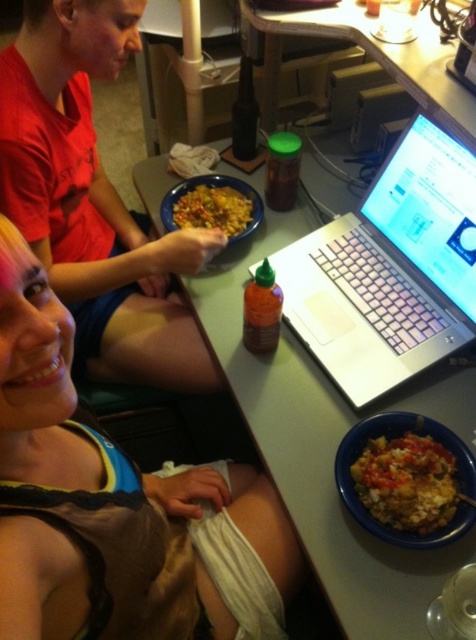
Does matte red shirt at upper left have a lesser width compared to green matte table at center?

Yes.

Between matte red shirt at upper left and green matte table at center, which one is positioned lower?

green matte table at center is lower down.

Image resolution: width=476 pixels, height=640 pixels. Find the location of `matte red shirt at upper left`. matte red shirt at upper left is located at coordinates (93, 200).

Which is above, matte brown tank top at lower left or silver metallic laptop at center?

silver metallic laptop at center is higher up.

This screenshot has width=476, height=640. What do you see at coordinates (116, 506) in the screenshot?
I see `matte brown tank top at lower left` at bounding box center [116, 506].

Where is `matte brown tank top at lower left`? matte brown tank top at lower left is located at coordinates (116, 506).

Does matte brown tank top at lower left appear over green matte table at center?

Incorrect, matte brown tank top at lower left is not positioned above green matte table at center.

Who is more forward, (171, 484) or (329, 490)?

Point (329, 490) is more forward.

Locate an element on the screen. The image size is (476, 640). matte brown tank top at lower left is located at coordinates (116, 506).